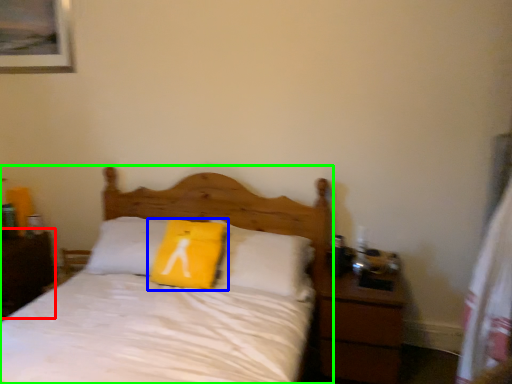
Question: Based on their relative distances, which object is nearer to nightstand (highlighted by a red box)? Choose from pillow (highlighted by a blue box) and bed (highlighted by a green box).

Choices:
 (A) pillow
 (B) bed

Answer: (B)